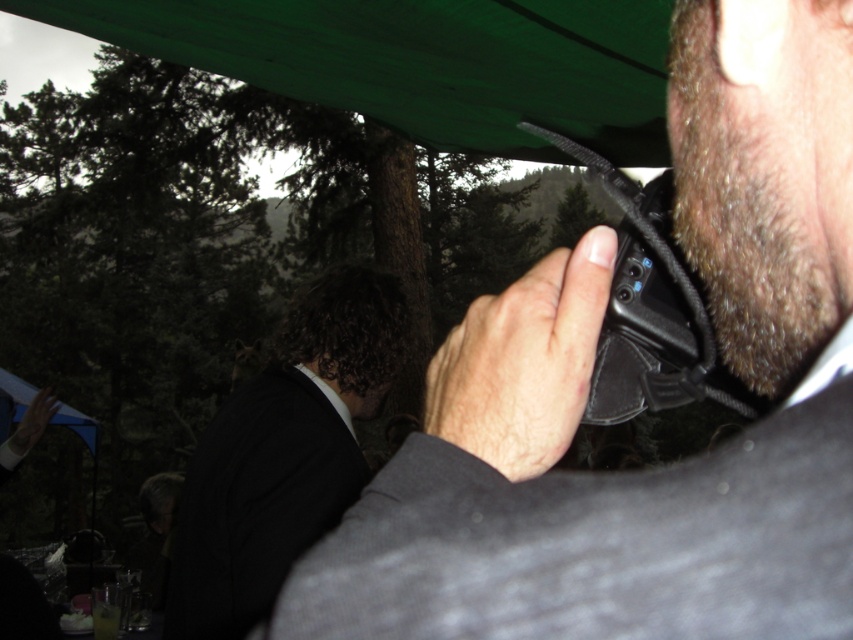
Is point (292, 592) closer to camera compared to point (173, 3)?

Yes.

Is black matte walkie-talkie at center wider than green fabric canopy at upper center?

No, black matte walkie-talkie at center is not wider than green fabric canopy at upper center.

Who is more forward, (689, 36) or (239, 60)?

Point (689, 36) is more forward.

You are a GUI agent. You are given a task and a screenshot of the screen. Output one action in this format:
    pyautogui.click(x=<x>, y=<y>)
    Task: Click on the black matte walkie-talkie at center
    This screenshot has height=640, width=853.
    Given the screenshot: What is the action you would take?
    pyautogui.click(x=581, y=500)

Can you confirm if dark brown fuzzy beard at right side is bigger than smooth black phone at center?

No, dark brown fuzzy beard at right side is not bigger than smooth black phone at center.

Is dark brown fuzzy beard at right side shorter than smooth black phone at center?

In fact, dark brown fuzzy beard at right side may be taller than smooth black phone at center.

Between point (844, 241) and point (461, 390), which one is positioned behind?

The point (461, 390) is more distant.

The width and height of the screenshot is (853, 640). I want to click on dark brown fuzzy beard at right side, so click(x=764, y=173).

Measure the distance between dark brown fuzzy beard at right side and black wool suit at center.

dark brown fuzzy beard at right side and black wool suit at center are 1.19 meters apart from each other.

Which is below, dark brown fuzzy beard at right side or black wool suit at center?

Positioned lower is black wool suit at center.

This screenshot has height=640, width=853. Find the location of `dark brown fuzzy beard at right side`. dark brown fuzzy beard at right side is located at coordinates (764, 173).